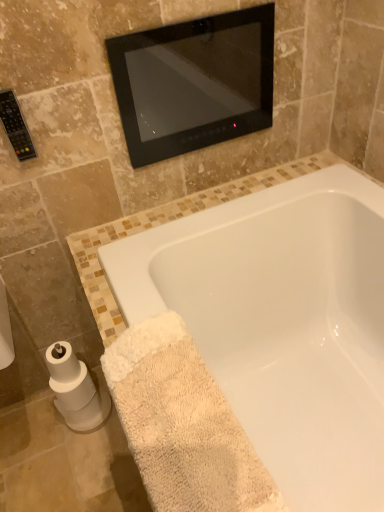
Question: Looking at their shapes, would you say white matte toilet paper at lower left is wider or thinner than white glossy bathtub at lower center?

Choices:
 (A) wide
 (B) thin

Answer: (B)

Question: From the image's perspective, relative to white glossy bathtub at lower center, is white matte toilet paper at lower left above or below?

Choices:
 (A) below
 (B) above

Answer: (A)

Question: Considering the real-world distances, which object is closest to the white glossy bathtub at lower center?

Choices:
 (A) white matte toilet paper at lower left
 (B) beige terry cloth bath towel at lower right
 (C) black glass mirror at upper center

Answer: (B)

Question: Based on their relative distances, which object is farther from the white glossy bathtub at lower center?

Choices:
 (A) white matte toilet paper at lower left
 (B) beige terry cloth bath towel at lower right
 (C) black glass mirror at upper center

Answer: (A)